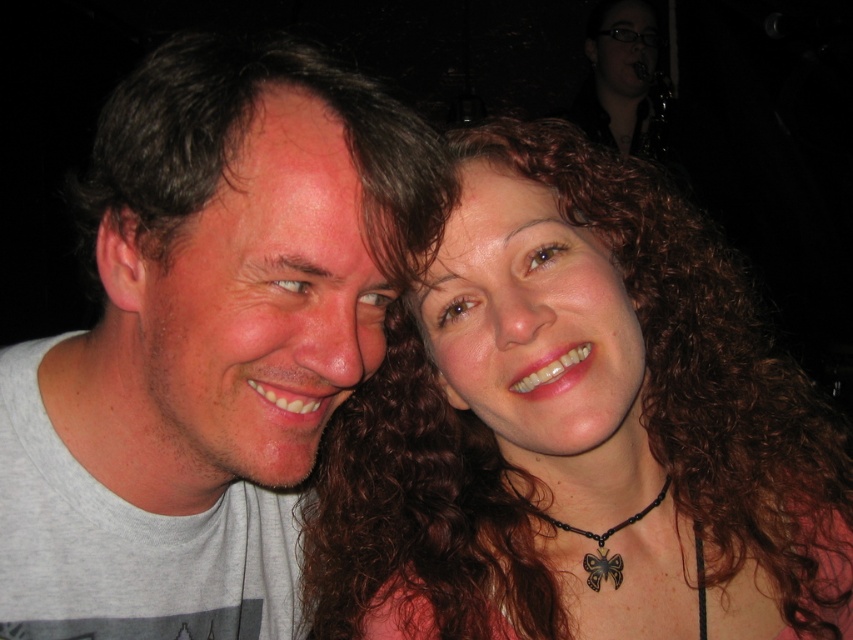
Question: Which object is the farthest from the matte pink hair at center?

Choices:
 (A) black beaded necklace with butterfly pendant at center
 (B) dark brown curly hair at left
 (C) gray t-shirt at left

Answer: (B)

Question: Among these objects, which one is farthest from the camera?

Choices:
 (A) gray t-shirt at left
 (B) dark brown curly hair at left
 (C) matte pink hair at center

Answer: (C)

Question: Which object is the closest to the matte pink hair at center?

Choices:
 (A) black beaded necklace with butterfly pendant at center
 (B) dark brown curly hair at left

Answer: (A)

Question: Can you confirm if matte pink hair at center is bigger than gray t-shirt at left?

Choices:
 (A) no
 (B) yes

Answer: (B)

Question: Is the position of dark brown curly hair at left more distant than that of black beaded necklace with butterfly pendant at center?

Choices:
 (A) yes
 (B) no

Answer: (B)

Question: Is matte pink hair at center positioned behind black beaded necklace with butterfly pendant at center?

Choices:
 (A) no
 (B) yes

Answer: (A)